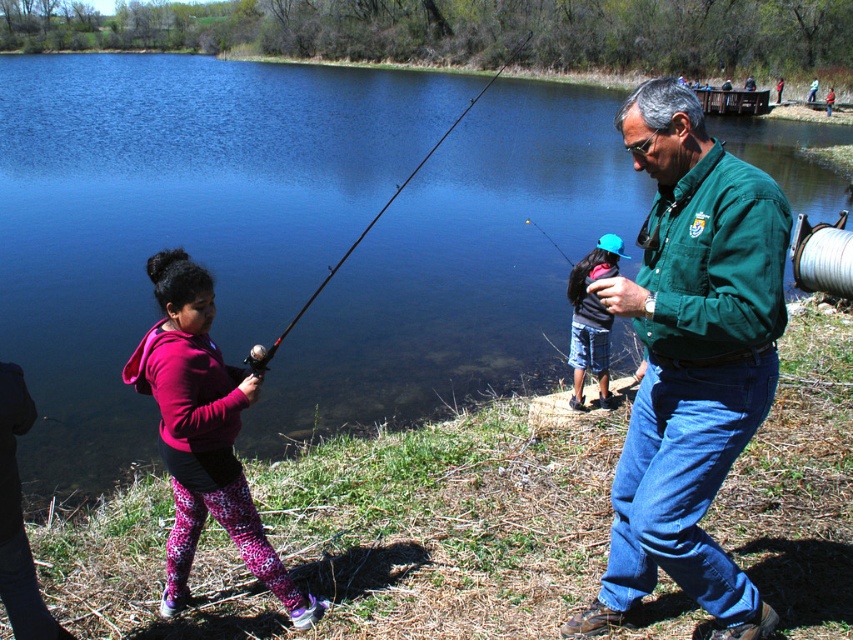
You are a photographer trying to capture a wide shot of the scene. The camera you are using has a maximum focus range of 5 meters. Can you ensure that both the matte pink hoodie at center and the black matte fishing pole at center will be in focus and clearly visible in the photo?

The matte pink hoodie at center and the black matte fishing pole at center are 4.14 meters apart. Since the camera can focus up to 5 meters, the distance between them is within the camera range. Therefore, both objects will be in focus and clearly visible in the photo.